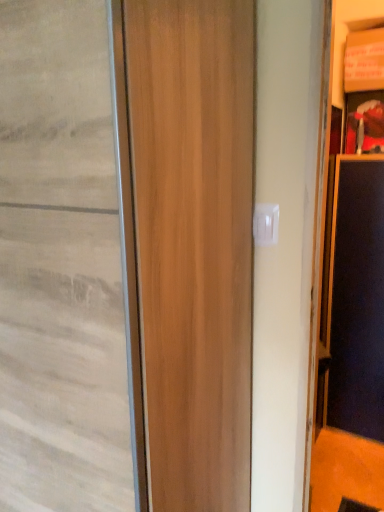
Describe the element at coordinates (357, 298) in the screenshot. I see `black matte screen door at right` at that location.

The width and height of the screenshot is (384, 512). Find the location of `black matte screen door at right`. black matte screen door at right is located at coordinates tap(357, 298).

What do you see at coordinates (60, 265) in the screenshot? This screenshot has height=512, width=384. I see `wooden door at center` at bounding box center [60, 265].

Where is `wooden door at center`? The image size is (384, 512). wooden door at center is located at coordinates (60, 265).

Measure the distance between wooden door at center and camera.

wooden door at center is 28.95 inches away from camera.

You are a GUI agent. You are given a task and a screenshot of the screen. Output one action in this format:
    pyautogui.click(x=<x>, y=<y>)
    Task: Click on the black matte screen door at right
    The image size is (384, 512).
    Given the screenshot: What is the action you would take?
    pyautogui.click(x=357, y=298)

Between wooden door at center and black matte screen door at right, which one appears on the left side from the viewer's perspective?

From the viewer's perspective, wooden door at center appears more on the left side.

Which is in front, wooden door at center or black matte screen door at right?

Positioned in front is wooden door at center.

Which point is more forward, (125, 357) or (364, 320)?

The point (125, 357) is closer.

From the image's perspective, between wooden door at center and black matte screen door at right, which one is located above?

wooden door at center, from the image's perspective.

From a real-world perspective, is wooden door at center positioned over black matte screen door at right based on gravity?

Yes, from a real-world perspective, wooden door at center is above black matte screen door at right.

Looking at this image, does wooden door at center have a greater width compared to black matte screen door at right?

Correct, the width of wooden door at center exceeds that of black matte screen door at right.

Considering the sizes of objects wooden door at center and black matte screen door at right in the image provided, who is taller, wooden door at center or black matte screen door at right?

With more height is wooden door at center.

Considering the relative sizes of wooden door at center and black matte screen door at right in the image provided, is wooden door at center smaller than black matte screen door at right?

Actually, wooden door at center might be larger than black matte screen door at right.

Is wooden door at center inside or outside of black matte screen door at right?

wooden door at center is not inside black matte screen door at right, it's outside.

Would you say wooden door at center is a long distance from black matte screen door at right?

Yes.

Could you tell me if wooden door at center is facing black matte screen door at right?

No, wooden door at center is not oriented towards black matte screen door at right.

The height and width of the screenshot is (512, 384). I want to click on screen door beneath the wooden door at center (from a real-world perspective), so click(357, 298).

Does black matte screen door at right appear on the left side of wooden door at center?

Incorrect, black matte screen door at right is not on the left side of wooden door at center.

Is black matte screen door at right positioned behind wooden door at center?

Yes, it is behind wooden door at center.

Which is behind, point (358, 293) or point (83, 418)?

The point (358, 293) is farther.

From the image's perspective, is black matte screen door at right located beneath wooden door at center?

Indeed, from the image's perspective, black matte screen door at right is shown beneath wooden door at center.

From a real-world perspective, which object stands above the other?

In real-world perspective, wooden door at center is above.

Between black matte screen door at right and wooden door at center, which one has larger width?

Wider between the two is wooden door at center.

Consider the image. Does black matte screen door at right have a greater height compared to wooden door at center?

No.

Considering the sizes of objects black matte screen door at right and wooden door at center in the image provided, who is smaller, black matte screen door at right or wooden door at center?

Smaller between the two is black matte screen door at right.

Is black matte screen door at right inside the boundaries of wooden door at center, or outside?

black matte screen door at right is spatially situated outside wooden door at center.

Is black matte screen door at right touching wooden door at center?

No, black matte screen door at right is not in contact with wooden door at center.

Is black matte screen door at right turned away from wooden door at center?

black matte screen door at right does not have its back to wooden door at center.

Can you tell me how much black matte screen door at right and wooden door at center differ in facing direction?

The facing directions of black matte screen door at right and wooden door at center are 1.1 degrees apart.

How distant is black matte screen door at right from wooden door at center?

black matte screen door at right is 1.66 meters away from wooden door at center.

The height and width of the screenshot is (512, 384). In order to click on screen door behind the wooden door at center in this screenshot , I will do `click(357, 298)`.

The image size is (384, 512). What are the coordinates of `door lying on the left of black matte screen door at right` in the screenshot? It's located at (60, 265).

Image resolution: width=384 pixels, height=512 pixels. In order to click on screen door below the wooden door at center (from the image's perspective) in this screenshot , I will do `click(357, 298)`.